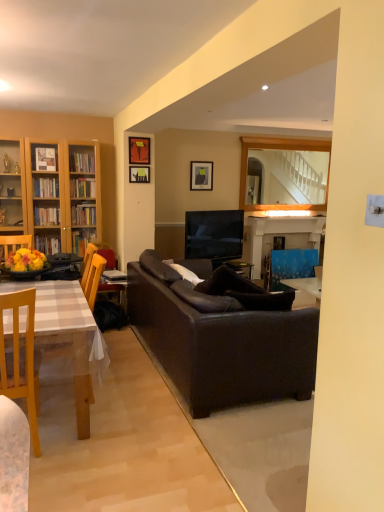
Question: Is wooden chair at left next to matte black picture frame at upper center, the 3th picture frame in the right-to-left sequence, and touching it?

Choices:
 (A) yes
 (B) no

Answer: (B)

Question: Considering the relative positions of wooden chair at left and matte black picture frame at upper center, acting as the 2th picture frame starting from the back, in the image provided, is wooden chair at left to the left of matte black picture frame at upper center, acting as the 2th picture frame starting from the back, from the viewer's perspective?

Choices:
 (A) yes
 (B) no

Answer: (A)

Question: From a real-world perspective, does wooden chair at left stand above matte black picture frame at upper center, acting as the 2th picture frame starting from the back?

Choices:
 (A) no
 (B) yes

Answer: (A)

Question: Is matte black picture frame at upper center, acting as the 1th picture frame starting from the left, at the back of wooden chair at left?

Choices:
 (A) no
 (B) yes

Answer: (A)

Question: From the image's perspective, is wooden chair at left under matte black picture frame at upper center, the 2th picture frame in the front-to-back sequence?

Choices:
 (A) no
 (B) yes

Answer: (B)

Question: Is there a large distance between wooden chair at left and matte black picture frame at upper center, the 2th picture frame in the front-to-back sequence?

Choices:
 (A) yes
 (B) no

Answer: (A)

Question: Is the position of blue painted wood fireplace at center more distant than that of matte black picture frame at upper center, acting as the 2th picture frame starting from the back?

Choices:
 (A) no
 (B) yes

Answer: (B)

Question: From the image's perspective, is blue painted wood fireplace at center above matte black picture frame at upper center, the 3th picture frame in the right-to-left sequence?

Choices:
 (A) no
 (B) yes

Answer: (A)

Question: Can you confirm if blue painted wood fireplace at center is smaller than matte black picture frame at upper center, the 2th picture frame in the front-to-back sequence?

Choices:
 (A) no
 (B) yes

Answer: (A)

Question: Is blue painted wood fireplace at center turned away from matte black picture frame at upper center, acting as the 2th picture frame starting from the back?

Choices:
 (A) no
 (B) yes

Answer: (A)

Question: Is matte black picture frame at upper center, acting as the 2th picture frame starting from the back, completely or partially inside blue painted wood fireplace at center?

Choices:
 (A) yes
 (B) no

Answer: (B)

Question: From the image's perspective, does blue painted wood fireplace at center appear lower than matte black picture frame at upper center, the 3th picture frame in the right-to-left sequence?

Choices:
 (A) no
 (B) yes

Answer: (B)

Question: Is matte black picture frame at upper center, positioned as the first picture frame in front-to-back order, positioned far away from blue painted wood fireplace at center?

Choices:
 (A) yes
 (B) no

Answer: (A)